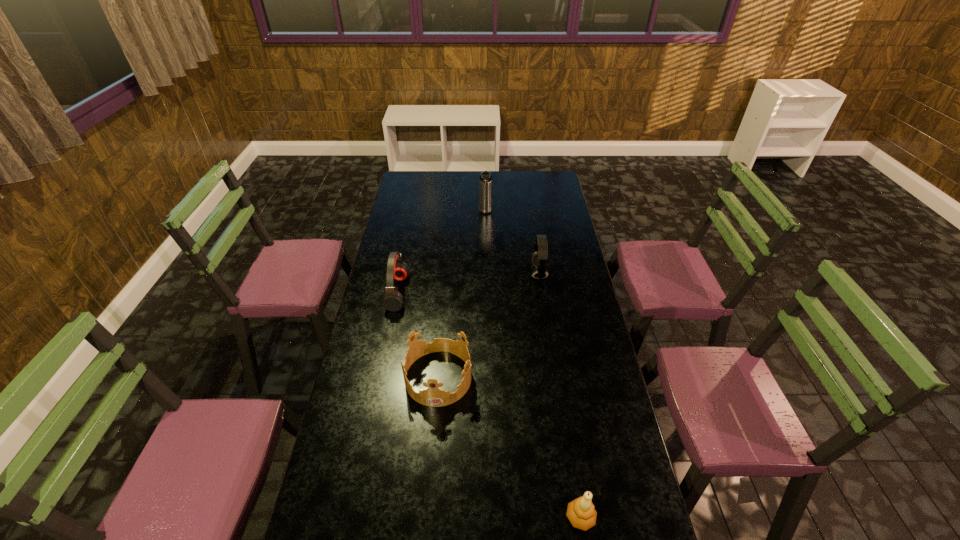
Locate an element on the screen. Image resolution: width=960 pixels, height=540 pixels. vacant space located 0.220m on the ear cups of the right earphone is located at coordinates (480, 273).

You are a GUI agent. You are given a task and a screenshot of the screen. Output one action in this format:
    pyautogui.click(x=<x>, y=<y>)
    Task: Click on the free location located on the ear cups of the leftmost object
    
    Given the screenshot: What is the action you would take?
    pyautogui.click(x=495, y=293)

Locate an element on the screen. Image resolution: width=960 pixels, height=540 pixels. vacant space located 0.080m on the front-facing side of the tiara is located at coordinates (434, 430).

The image size is (960, 540). I want to click on vacant area situated on the right of the candle_holder, so click(x=640, y=517).

Find the location of a particular element. Image resolution: width=960 pixels, height=540 pixels. object that is at the left edge is located at coordinates (396, 269).

Identify the location of earphone positioned at the right edge. (538, 259).

At what (x,y) coordinates should I click in order to perform the action: click on candle_holder situated at the right edge. Please return your answer as a coordinate pair (x, y). This screenshot has height=540, width=960. Looking at the image, I should click on (581, 513).

Where is `vacant point at the far edge`? The width and height of the screenshot is (960, 540). vacant point at the far edge is located at coordinates (520, 189).

At what (x,y) coordinates should I click in order to perform the action: click on vacant space at the left edge. Please return your answer as a coordinate pair (x, y). The height and width of the screenshot is (540, 960). Looking at the image, I should click on (376, 278).

The image size is (960, 540). Identify the location of vacant space at the right edge of the desktop. (542, 220).